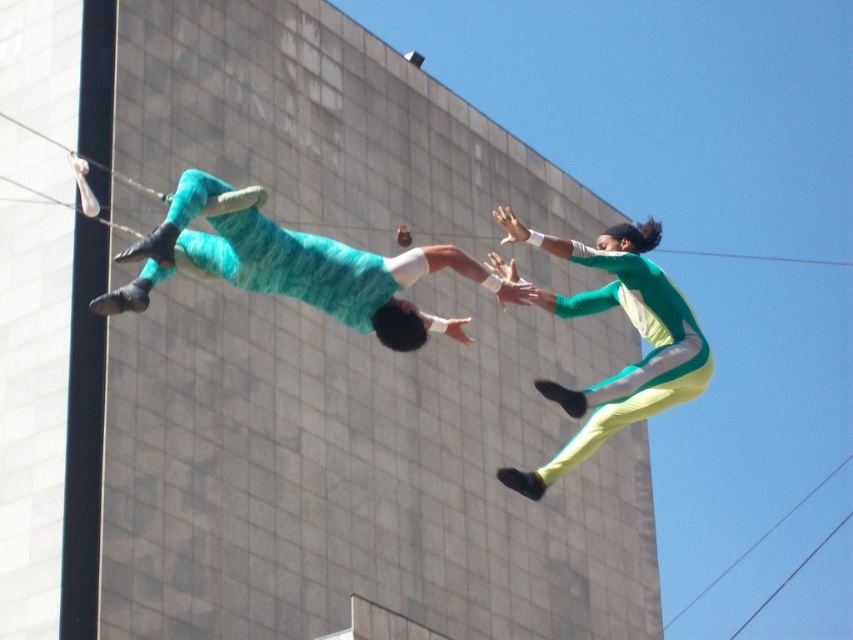
Between teal fabric body at center and green matte jumpsuit at upper right, which one is positioned lower?

green matte jumpsuit at upper right

From the picture: Can you confirm if teal fabric body at center is smaller than green matte jumpsuit at upper right?

Indeed, teal fabric body at center has a smaller size compared to green matte jumpsuit at upper right.

Is point (436, 252) positioned in front of point (495, 264)?

Yes, point (436, 252) is in front of point (495, 264).

I want to click on teal fabric body at center, so [x=294, y=268].